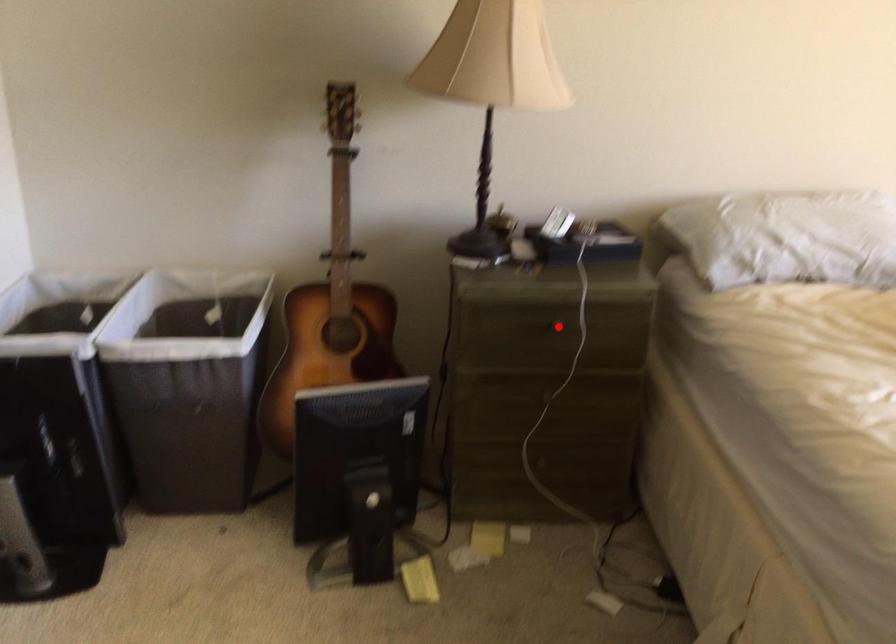
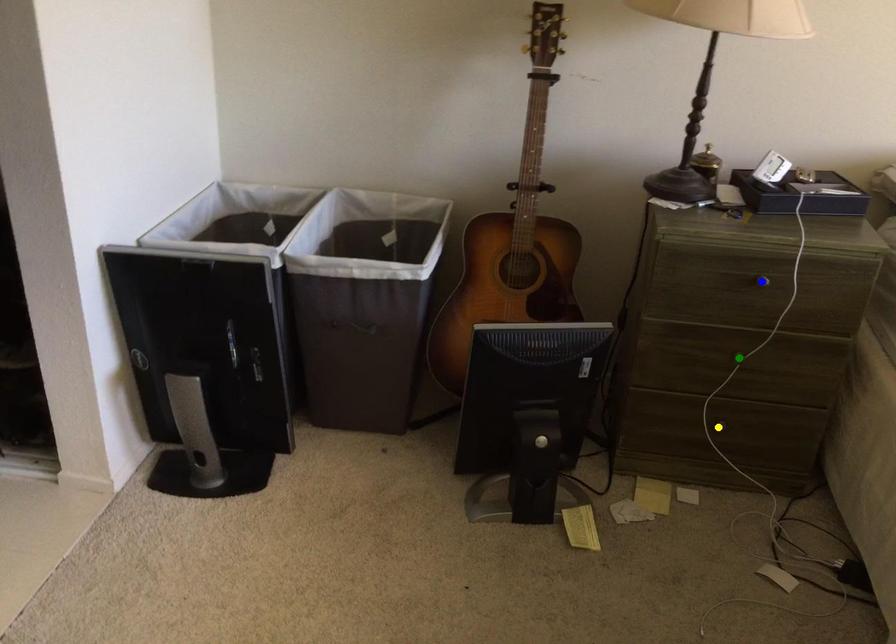
Question: I am providing you with two images of the same scene from different viewpoints. A red point is marked on the first image. You are given multiple points on the second image. Which spot in image 2 lines up with the point in image 1?

Choices:
 (A) yellow point
 (B) blue point
 (C) green point

Answer: (B)